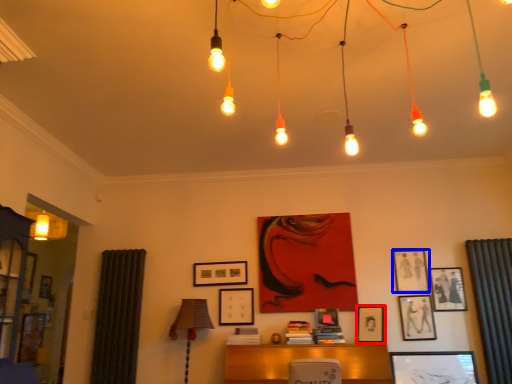
Question: Which of the following is the farthest to the observer, picture frame (highlighted by a red box) or picture frame (highlighted by a blue box)?

Choices:
 (A) picture frame
 (B) picture frame

Answer: (B)